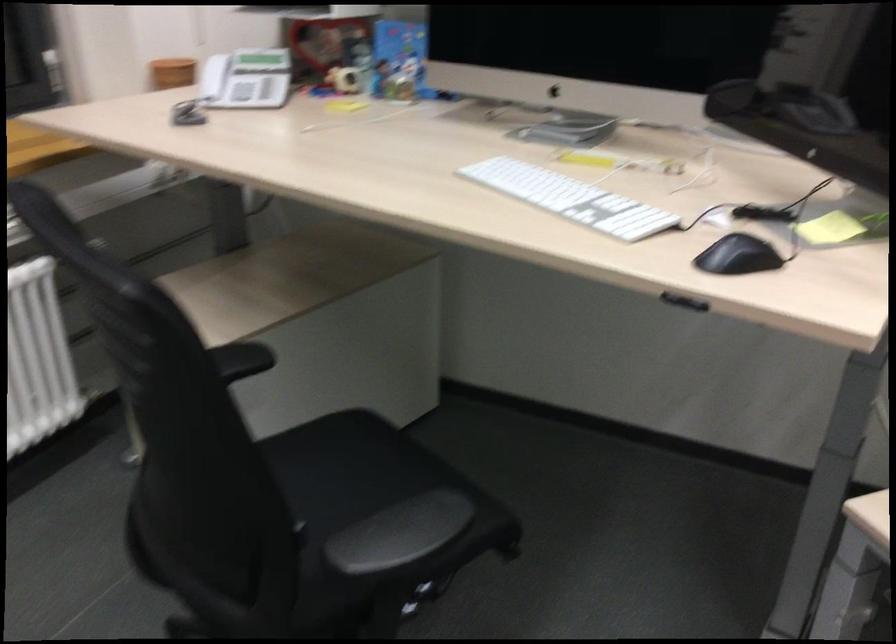
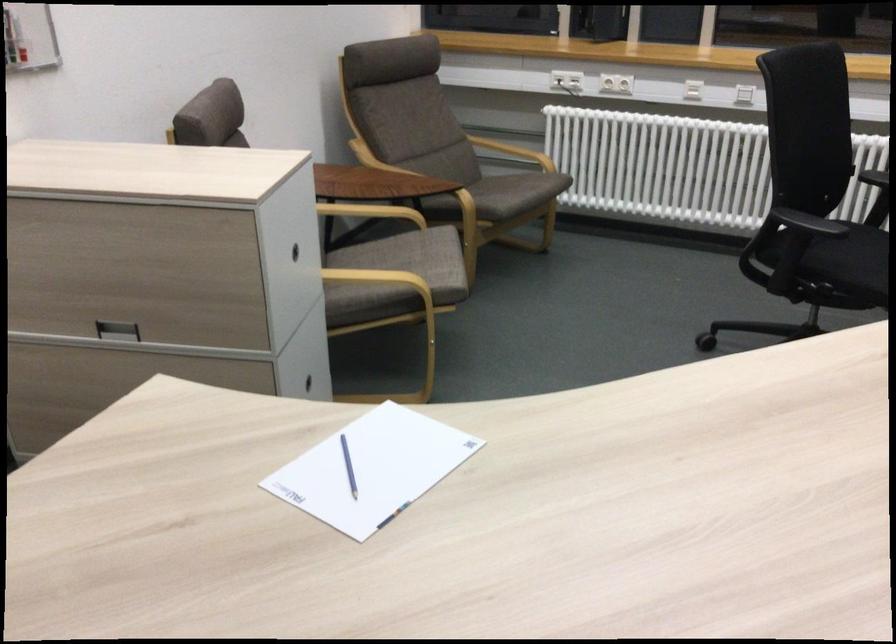
Where in the second image is the point corresponding to pixel 394 533 from the first image?

(849, 267)